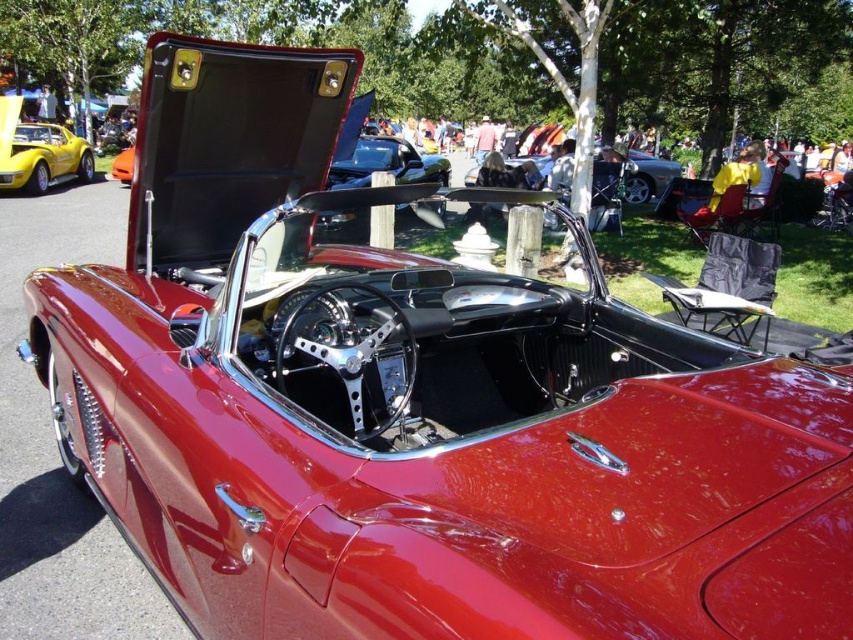
Consider the image. Is shiny yellow convertible at left to the right of shiny black convertible at center from the viewer's perspective?

In fact, shiny yellow convertible at left is to the left of shiny black convertible at center.

Does point (38, 145) lie in front of point (361, 212)?

No.

Between point (32, 179) and point (329, 188), which one is positioned in front?

Point (329, 188)

Where is `shiny yellow convertible at left`? The width and height of the screenshot is (853, 640). shiny yellow convertible at left is located at coordinates pos(38,150).